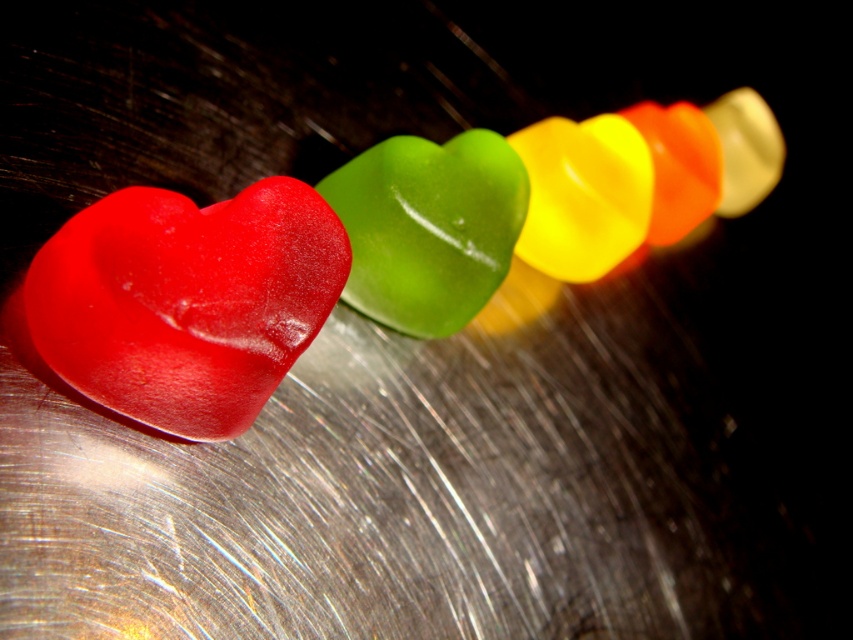
Question: Is matte red heart at left wider than glossy gelatin heart at center?

Choices:
 (A) yes
 (B) no

Answer: (A)

Question: Which point is farther to the camera?

Choices:
 (A) (480, 182)
 (B) (96, 355)
 (C) (397, 205)

Answer: (A)

Question: Is glossy gelatin heart at left smaller than glossy gelatin heart at center?

Choices:
 (A) no
 (B) yes

Answer: (A)

Question: Based on their relative distances, which object is nearer to the glossy gelatin heart at center?

Choices:
 (A) matte red heart at left
 (B) glossy gelatin heart at left

Answer: (B)

Question: Where is matte red heart at left located in relation to glossy gelatin heart at center in the image?

Choices:
 (A) below
 (B) above

Answer: (A)

Question: Which of the following is the closest to the observer?

Choices:
 (A) (340, 284)
 (B) (457, 188)

Answer: (A)